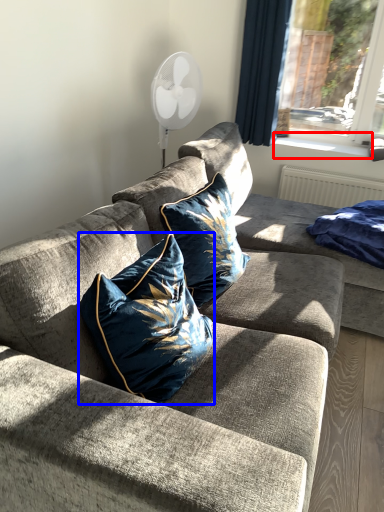
Question: Which point is closer to the camera, window sill (highlighted by a red box) or pillow (highlighted by a blue box)?

Choices:
 (A) window sill
 (B) pillow

Answer: (B)